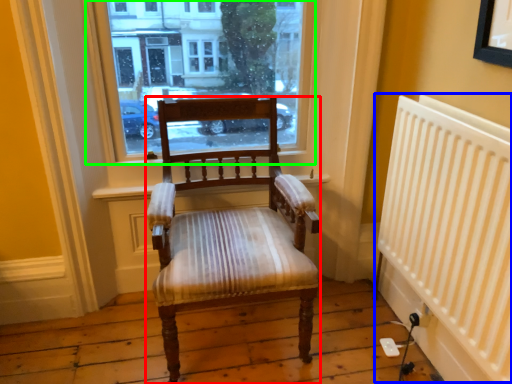
Question: Considering the real-world distances, which object is farthest from chair (highlighted by a red box)? radiator (highlighted by a blue box) or window (highlighted by a green box)?

Choices:
 (A) radiator
 (B) window

Answer: (A)